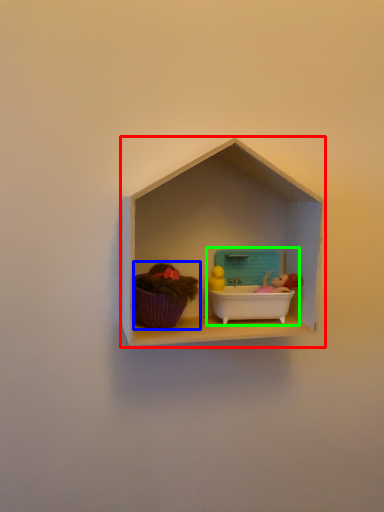
Question: Which object is positioned farthest from shelf (highlighted by a red box)? Select from toy (highlighted by a blue box) and lunch box (highlighted by a green box).

Choices:
 (A) toy
 (B) lunch box

Answer: (A)